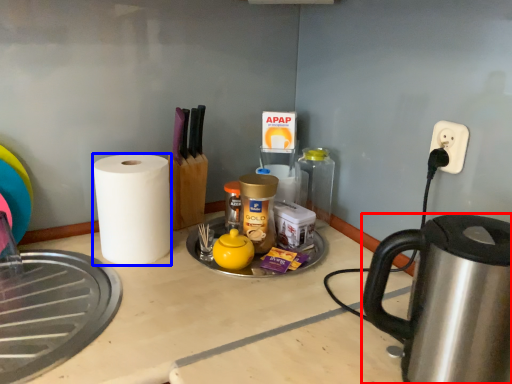
Question: Which object appears closest to the camera in this image, kettle (highlighted by a red box) or paper towel (highlighted by a blue box)?

Choices:
 (A) kettle
 (B) paper towel

Answer: (A)